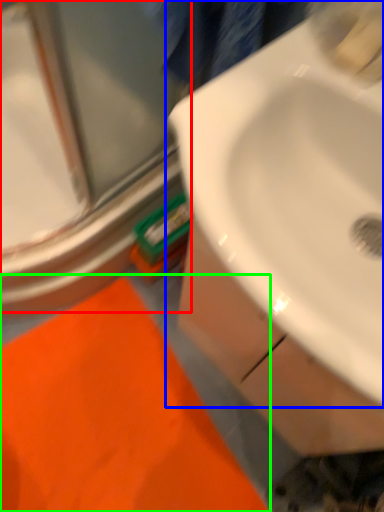
Question: Based on their relative distances, which object is nearer to glass door (highlighted by a red box)? Choose from sink (highlighted by a blue box) and bath mat (highlighted by a green box).

Choices:
 (A) sink
 (B) bath mat

Answer: (B)